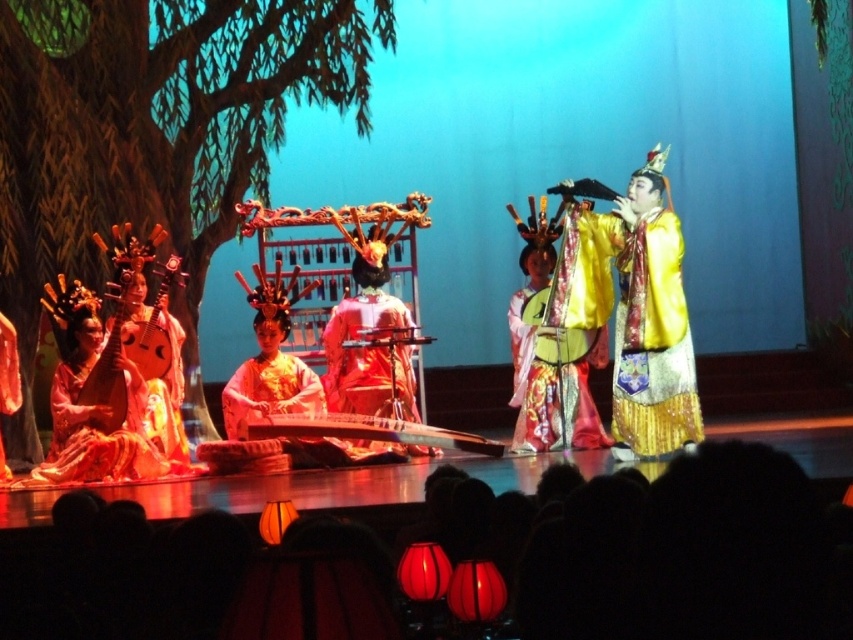
Is yellow satin robe at right positioned behind wooden stringed instrument at center?

No, it is in front of wooden stringed instrument at center.

Between yellow satin robe at right and wooden stringed instrument at center, which one has less height?

wooden stringed instrument at center

Locate an element on the screen. The width and height of the screenshot is (853, 640). yellow satin robe at right is located at coordinates (653, 344).

The width and height of the screenshot is (853, 640). In order to click on yellow satin robe at right in this screenshot , I will do `click(653, 344)`.

I want to click on silky gold robe at center, so click(360, 353).

Between silky gold robe at center and matte gold lute at left, which one has less height?

With less height is matte gold lute at left.

Locate an element on the screen. The image size is (853, 640). silky gold robe at center is located at coordinates (360, 353).

Can you confirm if silk embroidered robe at center is positioned above matte gold lute at left?

No.

Does point (582, 424) come closer to viewer compared to point (125, 275)?

No, it is behind (125, 275).

Where is `silk embroidered robe at center`? silk embroidered robe at center is located at coordinates tap(554, 381).